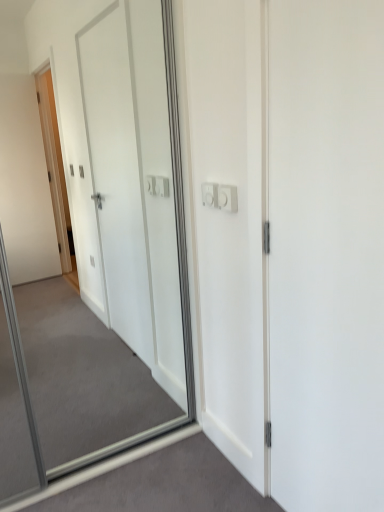
Measure the distance between white matte door at center and camera.

white matte door at center is 36.64 inches from camera.

The image size is (384, 512). Describe the element at coordinates (326, 253) in the screenshot. I see `white matte door at center` at that location.

Find the location of a particular element. Image resolution: width=384 pixels, height=512 pixels. white matte door at center is located at coordinates (326, 253).

At what (x,y) coordinates should I click in order to perform the action: click on white matte door at center. Please return your answer as a coordinate pair (x, y). The image size is (384, 512). Looking at the image, I should click on (326, 253).